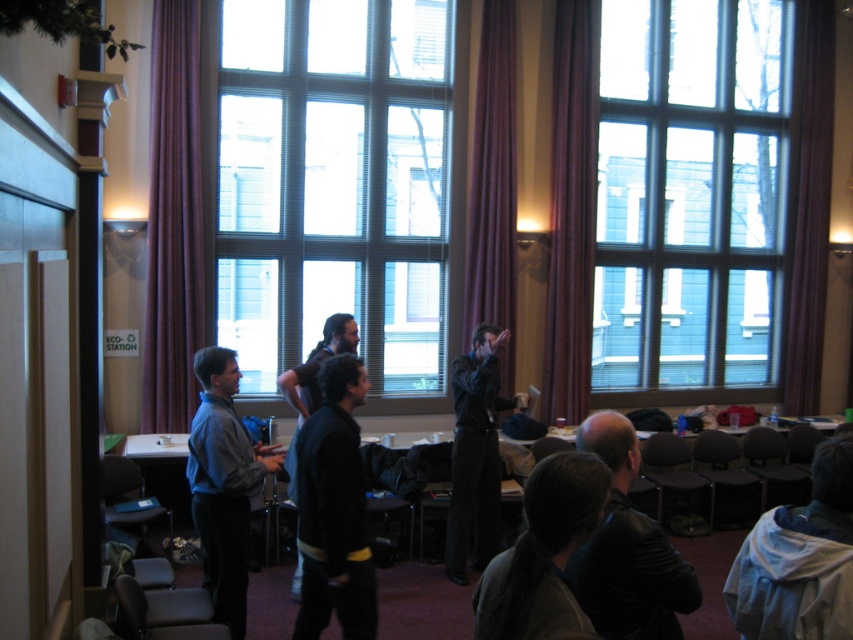
You are standing in the conference room and want to see the view outside through the clear glass window at upper right while also checking on the dark gray jacket at lower center. Which object is wider in terms of physical dimensions?

The clear glass window at upper right is wider than the dark gray jacket at lower center according to the description.

You are standing in the conference room and want to look outside through the clear glass window at center. Based on its position, where should you look relative to the room?

The clear glass window at center is located at point (852, 639), so you should look towards that coordinate to see outside.

You are a guest in this conference room and need to locate the ECO STATION sign mentioned in the agenda. You see the clear glass window at upper right and the dark gray jacket at lower center. Which object is positioned higher in the room?

The clear glass window at upper right is located above the dark gray jacket at lower center, so it is positioned higher in the room.